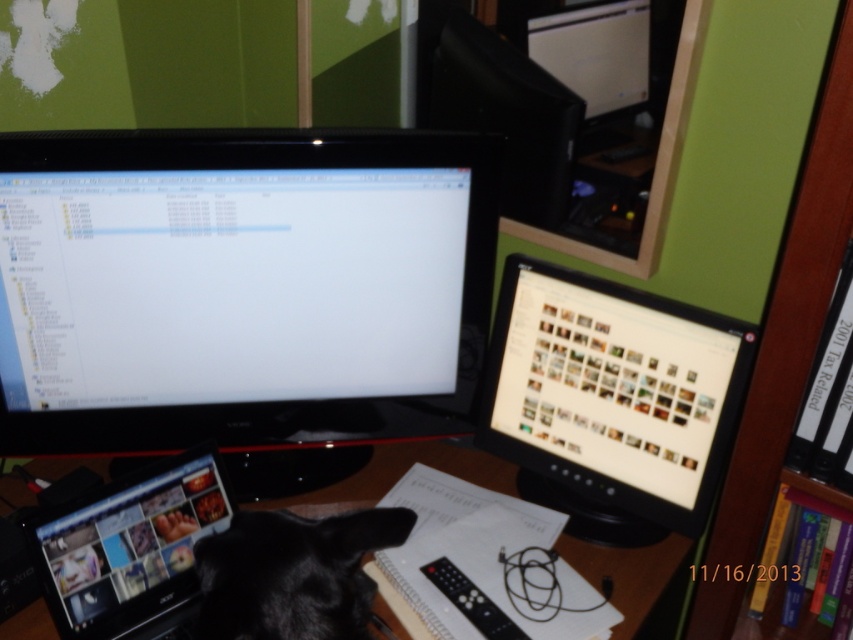
Question: Which object is the farthest from the wooden bookshelf at right?

Choices:
 (A) black fur cat at center
 (B) black glossy monitor at center
 (C) black plastic computer desk at center
 (D) matte black monitor at center

Answer: (A)

Question: Among these objects, which one is nearest to the camera?

Choices:
 (A) black plastic computer desk at center
 (B) black glossy tablet at lower left
 (C) black glossy monitor at center

Answer: (B)

Question: Is wooden bookshelf at right wider than black plastic computer desk at center?

Choices:
 (A) no
 (B) yes

Answer: (A)

Question: Is black glossy monitor at center to the left of black plastic computer desk at center from the viewer's perspective?

Choices:
 (A) yes
 (B) no

Answer: (A)

Question: Can you confirm if black fur cat at center is wider than black plastic computer desk at center?

Choices:
 (A) no
 (B) yes

Answer: (A)

Question: Based on their relative distances, which object is farther from the black glossy tablet at lower left?

Choices:
 (A) wooden bookshelf at right
 (B) matte black monitor at center
 (C) black plastic computer desk at center

Answer: (A)